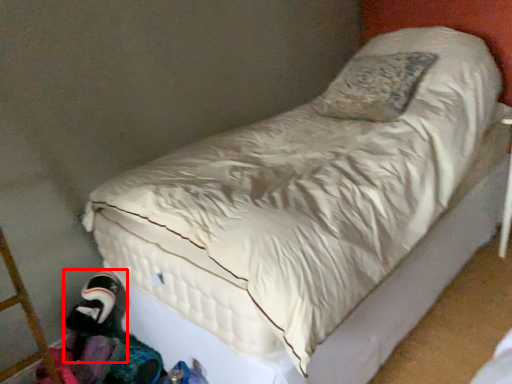
Question: Considering the relative positions of toy (annotated by the red box) and clothing in the image provided, where is toy (annotated by the red box) located with respect to the staircase?

Choices:
 (A) right
 (B) left

Answer: (B)